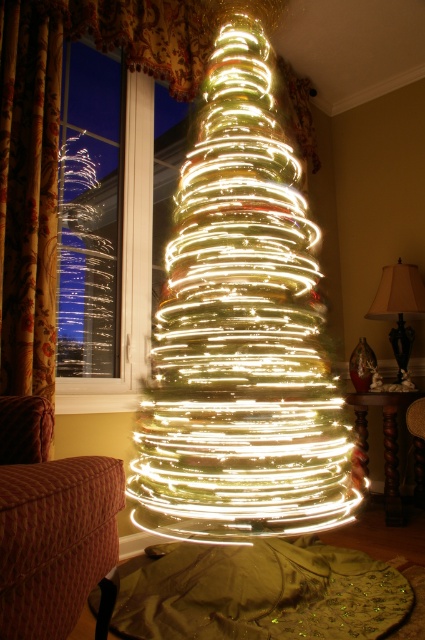
Question: Does illuminated wire at center appear on the left side of transparent glass window at upper left?

Choices:
 (A) no
 (B) yes

Answer: (A)

Question: Is illuminated wire at center further to camera compared to transparent glass window at upper left?

Choices:
 (A) yes
 (B) no

Answer: (B)

Question: In this image, where is illuminated wire at center located relative to transparent glass window at upper left?

Choices:
 (A) right
 (B) left

Answer: (A)

Question: Among these objects, which one is farthest from the camera?

Choices:
 (A) transparent glass window at upper left
 (B) illuminated wire at center

Answer: (A)

Question: Which of the following is the closest to the observer?

Choices:
 (A) illuminated wire at center
 (B) transparent glass window at upper left

Answer: (A)

Question: Which point is farther from the camera taking this photo?

Choices:
 (A) (76, 192)
 (B) (181, 268)

Answer: (A)